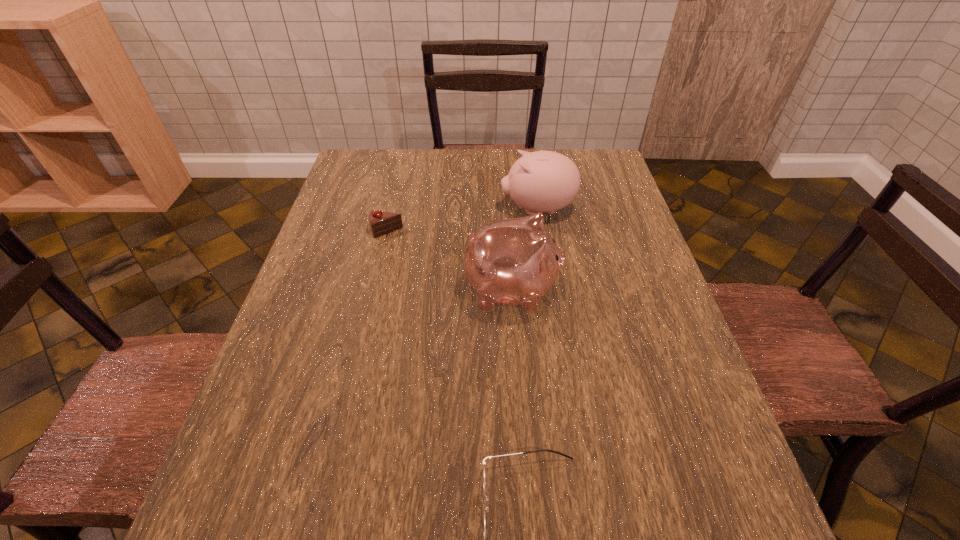
Where is `object that is at the left edge`? Image resolution: width=960 pixels, height=540 pixels. object that is at the left edge is located at coordinates (381, 222).

Identify the location of vacant space at the far edge of the desktop. (492, 185).

The image size is (960, 540). Find the location of `free location at the near edge of the desktop`. free location at the near edge of the desktop is located at coordinates (386, 539).

At what (x,y) coordinates should I click in order to perform the action: click on free location at the left edge of the desktop. Please return your answer as a coordinate pair (x, y). This screenshot has width=960, height=540. Looking at the image, I should click on (369, 229).

You are a GUI agent. You are given a task and a screenshot of the screen. Output one action in this format:
    pyautogui.click(x=<x>, y=<y>)
    Task: Click on the vacant space at the right edge of the desktop
    This screenshot has width=960, height=540.
    Given the screenshot: What is the action you would take?
    pyautogui.click(x=621, y=258)

Image resolution: width=960 pixels, height=540 pixels. I want to click on vacant point at the far left corner, so click(374, 157).

In the image, there is a desktop. Where is `free space at the far right corner`? This screenshot has height=540, width=960. free space at the far right corner is located at coordinates (609, 158).

Find the location of a particular element. The height and width of the screenshot is (540, 960). vacant space that's between the third tallest object and the farther piggy bank is located at coordinates (462, 220).

Locate an element on the screen. The height and width of the screenshot is (540, 960). free point between the second tallest object and the third tallest object is located at coordinates (462, 220).

You are a GUI agent. You are given a task and a screenshot of the screen. Output one action in this format:
    pyautogui.click(x=<x>, y=<y>)
    Task: Click on the vacant area that lies between the chocolate cake and the third farthest object
    
    Given the screenshot: What is the action you would take?
    pyautogui.click(x=449, y=261)